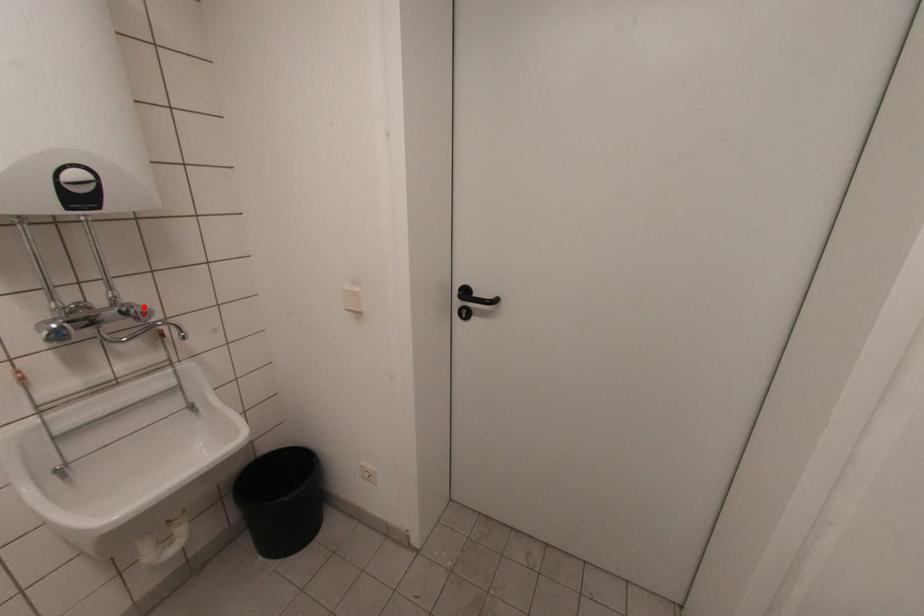
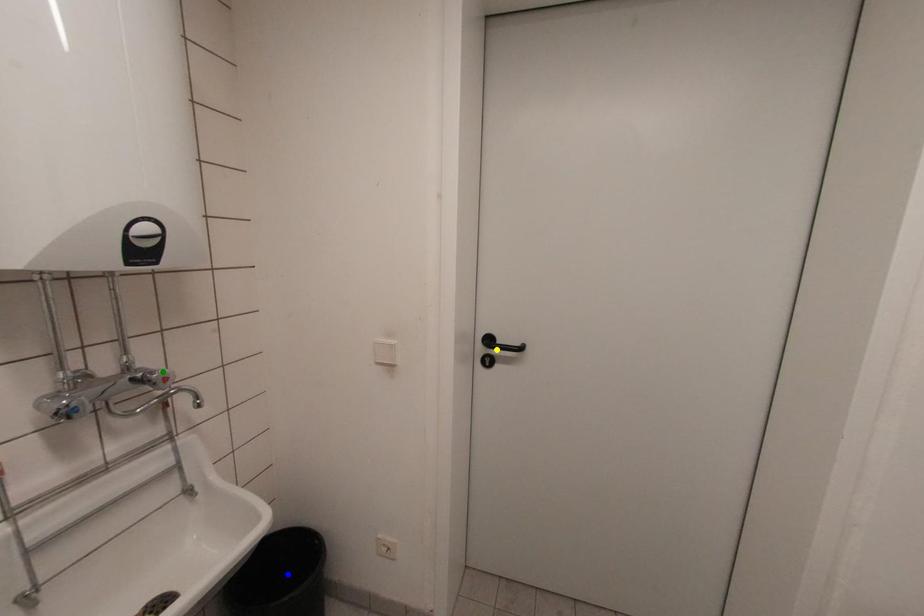
Question: I am providing you with two images of the same scene from different viewpoints. A red point is marked on the first image. You are given multiple points on the second image. Which point in image 2 is actually the same real-world point as the red point in image 1?

Choices:
 (A) yellow point
 (B) blue point
 (C) green point

Answer: (C)